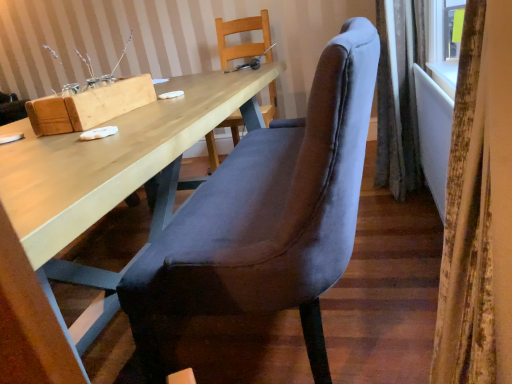
Question: From the image's perspective, is matte wood desk at center positioned above or below velvet gray curtain at right, positioned as the second curtain in front-to-back order?

Choices:
 (A) above
 (B) below

Answer: (B)

Question: Considering their positions, is matte wood desk at center located in front of or behind velvet gray curtain at right, which appears as the 1th curtain when viewed from the right?

Choices:
 (A) behind
 (B) front

Answer: (B)

Question: Which object is the closest to the transparent glass window at upper right?

Choices:
 (A) velvet curtain at right, placed as the second curtain when sorted from right to left
 (B) velvet gray curtain at right, positioned as the second curtain in front-to-back order
 (C) wooden chair at upper center, marked as the first chair in a back-to-front arrangement
 (D) velvet grey chair at center, positioned as the 1th chair in front-to-back order
 (E) matte wood desk at center

Answer: (B)

Question: Which is farther from the transparent glass window at upper right?

Choices:
 (A) velvet gray curtain at right, which appears as the 1th curtain when viewed from the right
 (B) velvet curtain at right, which is the 1th curtain in left-to-right order
 (C) velvet grey chair at center, the 2th chair positioned from the back
 (D) wooden chair at upper center, marked as the first chair in a back-to-front arrangement
 (E) matte wood desk at center

Answer: (D)